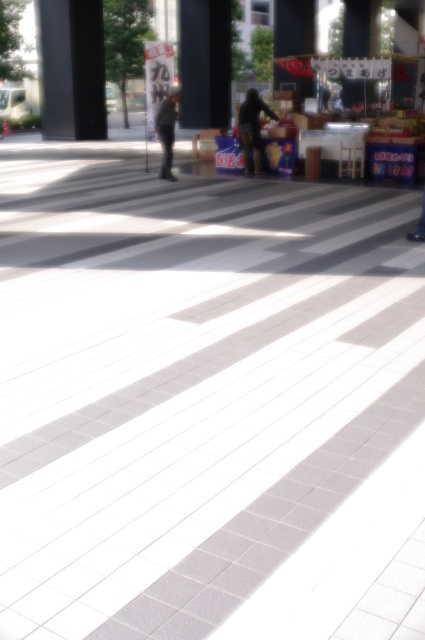
Question: Which point is farther from the camera taking this photo?

Choices:
 (A) (70, 35)
 (B) (271, 115)
 (C) (166, 106)

Answer: (A)

Question: Does smooth black pillar at upper left appear over dark matte figure at center?

Choices:
 (A) no
 (B) yes

Answer: (B)

Question: Which point is farther from the camera taking this photo?

Choices:
 (A) (246, 168)
 (B) (87, 29)

Answer: (B)

Question: Considering the relative positions of smooth black pillar at upper left and dark matte figure at center in the image provided, where is smooth black pillar at upper left located with respect to dark matte figure at center?

Choices:
 (A) left
 (B) right

Answer: (A)

Question: Does smooth black pillar at upper left appear on the left side of dark matte figure at center?

Choices:
 (A) no
 (B) yes

Answer: (B)

Question: Which point appears closest to the camera in this image?

Choices:
 (A) (78, 104)
 (B) (167, 97)

Answer: (B)